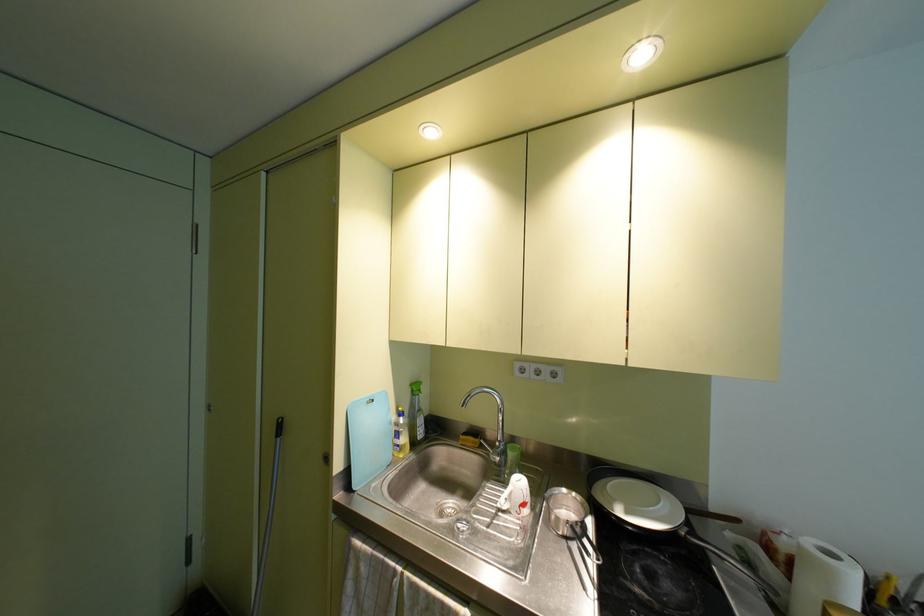
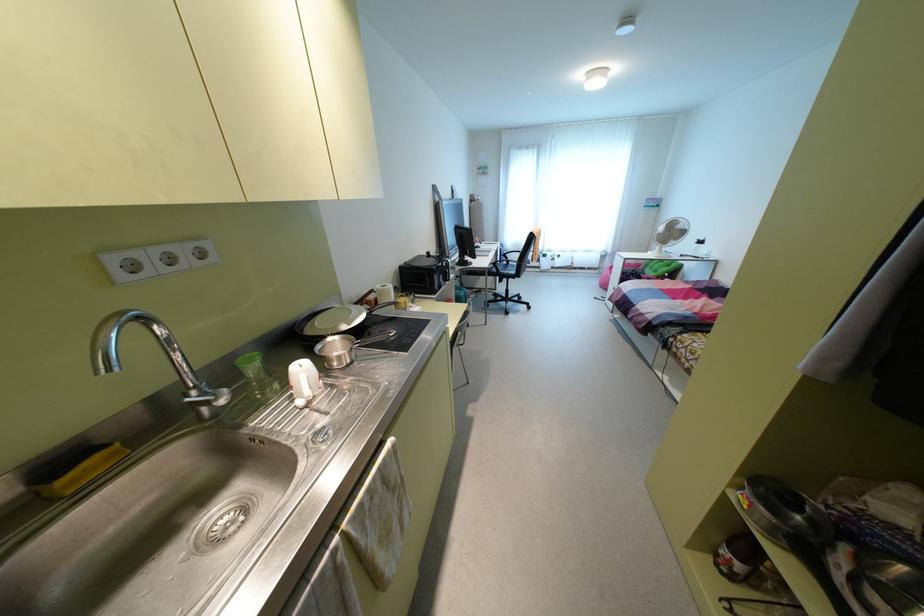
Find the pixel in the second image that matches the point at 544,370 in the first image.

(181, 251)